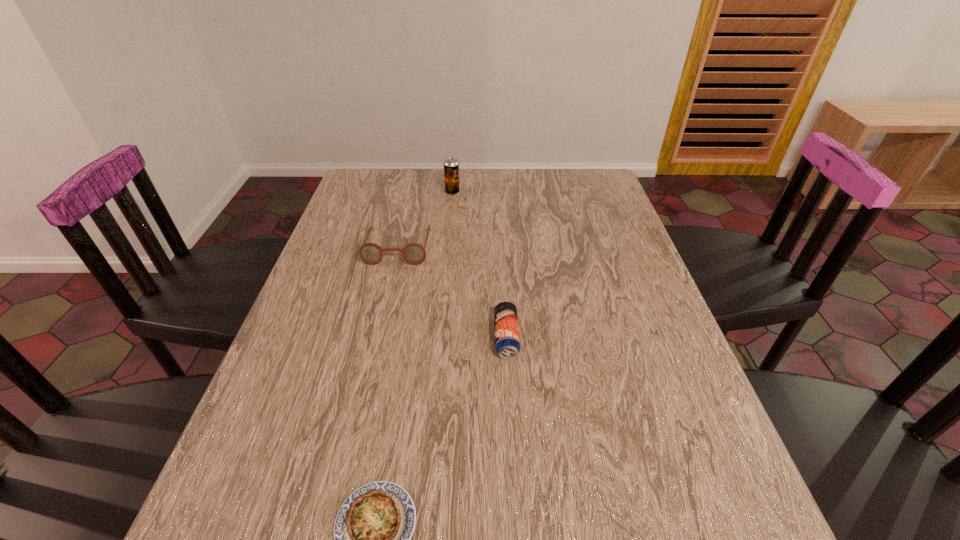
Where is `the farther beer can`? the farther beer can is located at coordinates (451, 166).

You are a GUI agent. You are given a task and a screenshot of the screen. Output one action in this format:
    pyautogui.click(x=<x>, y=<y>)
    Task: Click on the taller beer can
    
    Given the screenshot: What is the action you would take?
    pyautogui.click(x=451, y=166)

Where is `the second farthest object`? The image size is (960, 540). the second farthest object is located at coordinates (370, 253).

You are a GUI agent. You are given a task and a screenshot of the screen. Output one action in this format:
    pyautogui.click(x=<x>, y=<y>)
    Task: Click on the third shortest object
    The width and height of the screenshot is (960, 540).
    Given the screenshot: What is the action you would take?
    pyautogui.click(x=370, y=253)

Find the location of a particular element. The image size is (960, 540). the third farthest object is located at coordinates (507, 342).

The height and width of the screenshot is (540, 960). What are the coordinates of `the rightmost object` in the screenshot? It's located at (507, 342).

Find the location of a particular element. The image size is (960, 540). vacant space located on the left of the farther beer can is located at coordinates (427, 192).

Locate an element on the screen. vacant space located on the front-facing side of the spectacles is located at coordinates (389, 289).

Identify the location of vacant space positioned on the right of the shorter beer can. The image size is (960, 540). (572, 338).

Where is `object that is at the far edge`? object that is at the far edge is located at coordinates (451, 166).